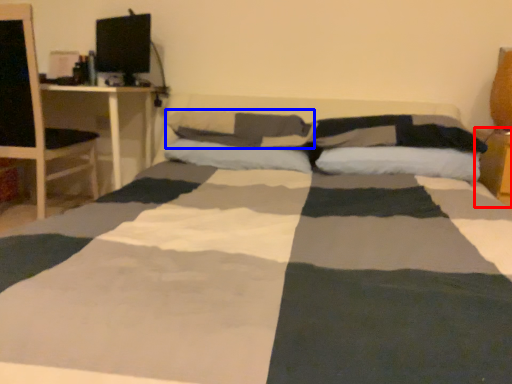
Question: Which point is closer to the camera, table (highlighted by a red box) or pillow (highlighted by a blue box)?

Choices:
 (A) table
 (B) pillow

Answer: (A)